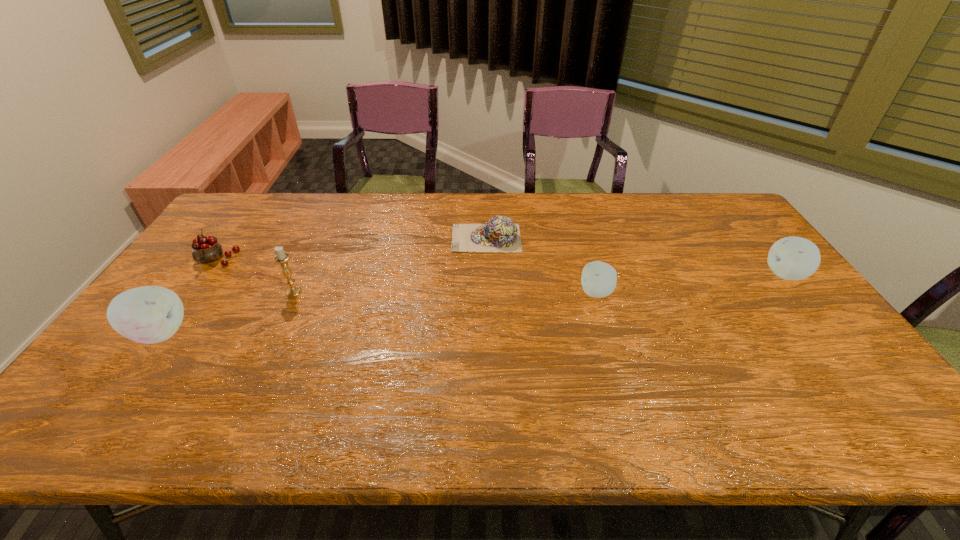
This screenshot has height=540, width=960. Identify the location of vacant area in the image that satisfies the following two spatial constraints: 1. on the front, side, and top of the fourth object from left to right; 2. on the back side of the second tallest apple. (487, 275).

At what (x,y) coordinates should I click in order to perform the action: click on free region that satisfies the following two spatial constraints: 1. on the handle side of the cherry; 2. on the left side of the rightmost apple. Please return your answer as a coordinate pair (x, y). Image resolution: width=960 pixels, height=540 pixels. Looking at the image, I should click on (205, 275).

This screenshot has width=960, height=540. I want to click on free point that satisfies the following two spatial constraints: 1. on the handle side of the cherry; 2. on the left side of the shortest apple, so click(x=193, y=293).

The image size is (960, 540). I want to click on free space that satisfies the following two spatial constraints: 1. on the front, side, and top of the cap; 2. on the right side of the second apple from right to left, so click(488, 293).

Identify the location of vacant position in the image that satisfies the following two spatial constraints: 1. on the front, side, and top of the fourth object from left to right; 2. on the handle side of the cherry. (487, 260).

The height and width of the screenshot is (540, 960). Find the location of `free location that satisfies the following two spatial constraints: 1. on the back side of the rightmost apple; 2. on the right side of the third object from left to right`. free location that satisfies the following two spatial constraints: 1. on the back side of the rightmost apple; 2. on the right side of the third object from left to right is located at coordinates (301, 275).